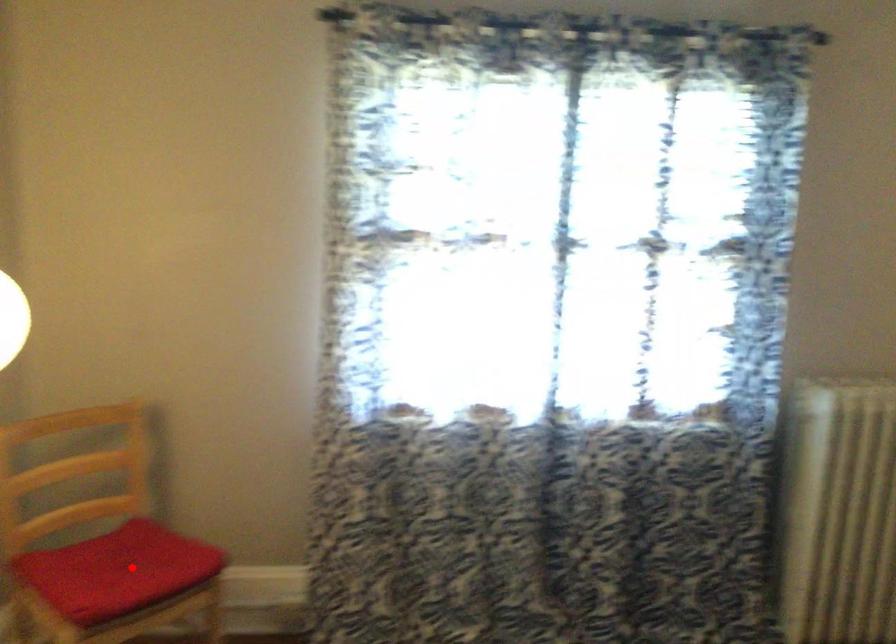
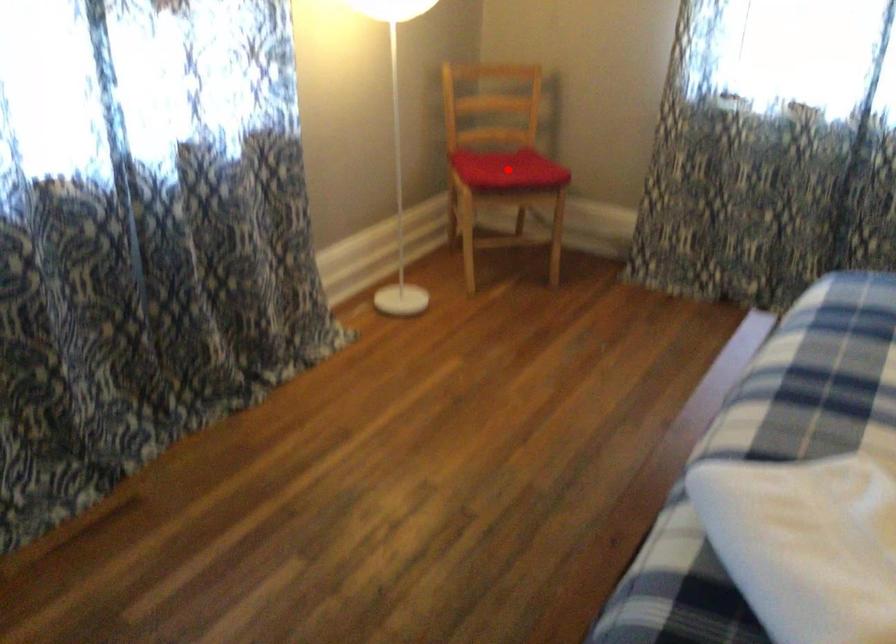
I am providing you with two images of the same scene from different viewpoints. A red point is marked on the first image and another point is marked on the second image. Is the marked point in image1 the same physical position as the marked point in image2?

Yes